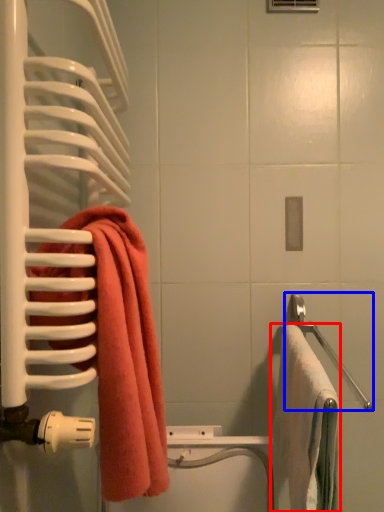
Question: Which object appears closest to the camera in this image, towel (highlighted by a red box) or towel bar (highlighted by a blue box)?

Choices:
 (A) towel
 (B) towel bar

Answer: (A)